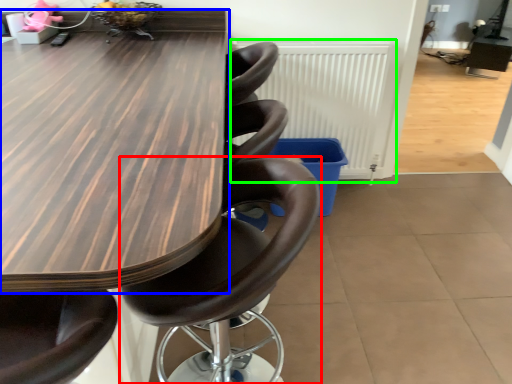
Question: Which is nearer to the chair (highlighted by a red box)? table (highlighted by a blue box) or radiator (highlighted by a green box).

Choices:
 (A) table
 (B) radiator

Answer: (A)